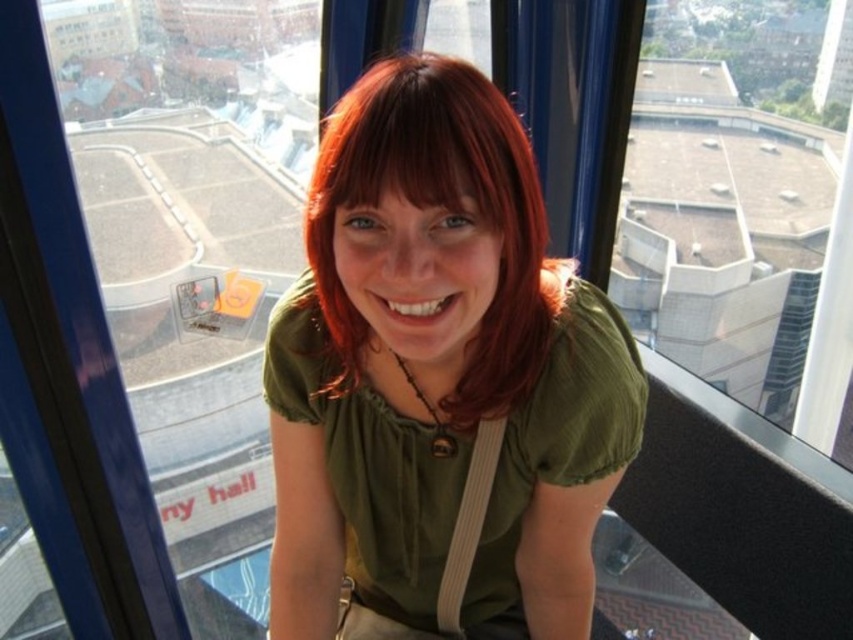
You are an architect designing a new building. You want to place a window in the building such that it will frame the matte green shirt at center perfectly. Where should you place the window?

The matte green shirt at center is located at coordinates point (439, 380), so the window should be positioned at those coordinates to frame it perfectly.

You are standing in the glass elevator and want to take a photo of the cityscape through the window. There are two points marked on the window where you can place your camera. The first point is at coordinates point (x=395, y=260) and the second is at point (x=430, y=81). Which point is closer to the back of the elevator?

Point (x=430, y=81) is closer to the back of the elevator because point (x=395, y=260) is behind it.